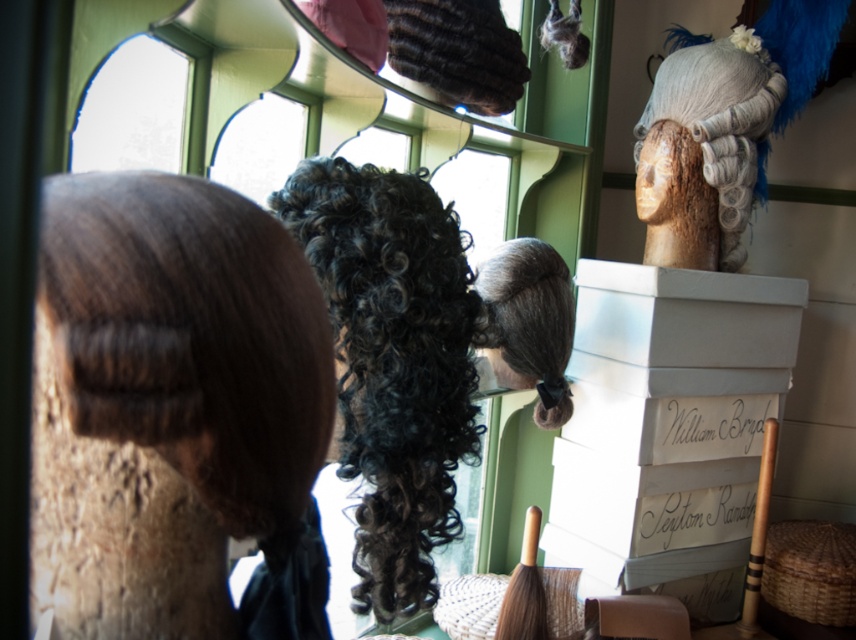
You are a customer in a wig shop and want to find the white fabric wig at upper right. Which direction should you look relative to the dark brown curly wig at center?

The white fabric wig at upper right is located to the right of the dark brown curly wig at center, so you should look to the right of the dark brown curly wig at center to find it.

Based on the photo, you are a customer in a wig shop and want to choose between the curly dark brown wig at center and the white fabric wig at upper right. Which wig is taller?

The curly dark brown wig at center is much taller than the white fabric wig at upper right.